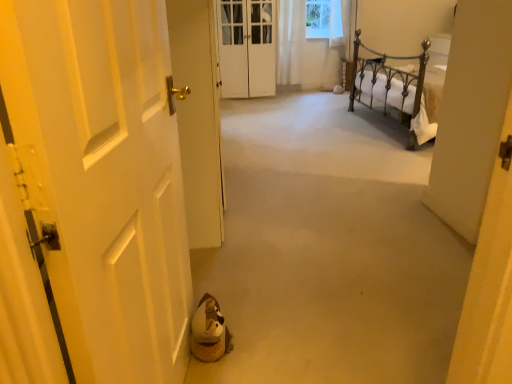
Where is `white matte door at left, which appears as the 3th door when viewed from the back`? The height and width of the screenshot is (384, 512). white matte door at left, which appears as the 3th door when viewed from the back is located at coordinates (103, 178).

This screenshot has height=384, width=512. Describe the element at coordinates (103, 178) in the screenshot. I see `white matte door at left, which ranks as the first door in front-to-back order` at that location.

Where is `white sheer curtain at upper center`? The width and height of the screenshot is (512, 384). white sheer curtain at upper center is located at coordinates [291, 41].

Describe the element at coordinates (247, 48) in the screenshot. The image size is (512, 384). I see `white wooden door at center, the 3th door positioned from the front` at that location.

This screenshot has width=512, height=384. In order to click on white matte door at left, which appears as the 3th door when viewed from the back in this screenshot , I will do `click(103, 178)`.

Is white matte door at left, which appears as the 3th door when viewed from the back, at the right side of white sheer curtain at upper center?

No.

Would you say white sheer curtain at upper center is part of white matte door at left, which appears as the 3th door when viewed from the back,'s contents?

No, white sheer curtain at upper center is not surrounded by white matte door at left, which appears as the 3th door when viewed from the back.

From the image's perspective, is white matte door at left, which appears as the 3th door when viewed from the back, beneath white sheer curtain at upper center?

Indeed, from the image's perspective, white matte door at left, which appears as the 3th door when viewed from the back, is shown beneath white sheer curtain at upper center.

Which door is the 2nd one when counting from the left side of the beige carpet at center? Please provide its 2D coordinates.

[(103, 178)]

From the picture: Can you confirm if beige carpet at center is taller than white matte door at left, which ranks as the first door in front-to-back order?

No.

Does beige carpet at center turn towards white matte door at left, which appears as the 3th door when viewed from the back?

No, beige carpet at center is not aimed at white matte door at left, which appears as the 3th door when viewed from the back.

Based on the photo, which point is more forward, (402, 262) or (139, 2)?

The point (139, 2) is closer to the camera.

Is beige carpet at center aimed at white glossy door at left, positioned as the second door in back-to-front order?

No, beige carpet at center is not facing towards white glossy door at left, positioned as the second door in back-to-front order.

Is beige carpet at center taller or shorter than white glossy door at left, the second door in the front-to-back sequence?

Considering their sizes, beige carpet at center has less height than white glossy door at left, the second door in the front-to-back sequence.

Are beige carpet at center and white glossy door at left, the second door in the front-to-back sequence, making contact?

There is a gap between beige carpet at center and white glossy door at left, the second door in the front-to-back sequence.

Is beige carpet at center thinner than white glossy door at left, positioned as the second door in back-to-front order?

In fact, beige carpet at center might be wider than white glossy door at left, positioned as the second door in back-to-front order.

Who is taller, white wooden door at center, the 3th door positioned from the front, or beige carpet at center?

Standing taller between the two is white wooden door at center, the 3th door positioned from the front.

From a real-world perspective, who is located higher, white wooden door at center, the 3th door positioned from the front, or beige carpet at center?

white wooden door at center, the 3th door positioned from the front, from a real-world perspective.

Is point (246, 43) behind point (377, 166)?

Yes.

Could you tell me if white wooden door at center, the 3th door positioned from the front, is facing beige carpet at center?

Yes, white wooden door at center, the 3th door positioned from the front, is turned towards beige carpet at center.

Is white glossy door at left, positioned as the second door in back-to-front order, spatially inside white wooden door at center, acting as the first door starting from the back, or outside of it?

The correct answer is: outside.

From the image's perspective, which one is positioned higher, white glossy door at left, positioned as the second door in back-to-front order, or white wooden door at center, acting as the first door starting from the back?

white wooden door at center, acting as the first door starting from the back, from the image's perspective.

From a real-world perspective, starting from the white wooden door at center, the 3th door positioned from the front, which door is the 1st one below it? Please provide its 2D coordinates.

[(198, 117)]

Is white glossy door at left, positioned as the second door in back-to-front order, facing away from white wooden door at center, acting as the first door starting from the back?

No, white glossy door at left, positioned as the second door in back-to-front order,'s orientation is not away from white wooden door at center, acting as the first door starting from the back.

From a real-world perspective, which object stands above the other?

From a 3D spatial view, white glossy door at left, positioned as the second door in back-to-front order, is above.

Can you tell me how much white glossy door at left, positioned as the second door in back-to-front order, and beige carpet at center differ in facing direction?

The angular difference between white glossy door at left, positioned as the second door in back-to-front order, and beige carpet at center is 90.1 degrees.

Is beige carpet at center at the back of white glossy door at left, positioned as the second door in back-to-front order?

No, white glossy door at left, positioned as the second door in back-to-front order,'s orientation is not away from beige carpet at center.

Is white sheer curtain at upper center further to the viewer compared to white glossy door at left, positioned as the second door in back-to-front order?

Yes, the depth of white sheer curtain at upper center is greater than that of white glossy door at left, positioned as the second door in back-to-front order.

From a real-world perspective, is white sheer curtain at upper center below white glossy door at left, positioned as the second door in back-to-front order?

Actually, white sheer curtain at upper center is physically above white glossy door at left, positioned as the second door in back-to-front order, in the real world.

Considering the relative sizes of white sheer curtain at upper center and white glossy door at left, the second door in the front-to-back sequence, in the image provided, is white sheer curtain at upper center taller than white glossy door at left, the second door in the front-to-back sequence,?

No.

Could you tell me if white sheer curtain at upper center is turned towards white glossy door at left, the second door in the front-to-back sequence?

No.

Where is `door that is the 3rd object located in front of the white sheer curtain at upper center`? Image resolution: width=512 pixels, height=384 pixels. door that is the 3rd object located in front of the white sheer curtain at upper center is located at coordinates (103, 178).

This screenshot has height=384, width=512. In order to click on door below the beige carpet at center (from the image's perspective) in this screenshot , I will do `click(103, 178)`.

Considering their positions, is beige carpet at center positioned further to white wooden door at center, the 3th door positioned from the front, than white sheer curtain at upper center?

The object further to white wooden door at center, the 3th door positioned from the front, is beige carpet at center.

Based on their spatial positions, is beige carpet at center or white sheer curtain at upper center closer to white glossy door at left, positioned as the second door in back-to-front order?

beige carpet at center.

Based on their spatial positions, is beige carpet at center or white sheer curtain at upper center closer to white matte door at left, which ranks as the first door in front-to-back order?

beige carpet at center.

Considering their positions, is beige carpet at center positioned further to white wooden door at center, acting as the first door starting from the back, than white glossy door at left, positioned as the second door in back-to-front order?

white glossy door at left, positioned as the second door in back-to-front order, lies further to white wooden door at center, acting as the first door starting from the back, than the other object.

Based on their spatial positions, is beige carpet at center or white glossy door at left, positioned as the second door in back-to-front order, further from white sheer curtain at upper center?

Among the two, white glossy door at left, positioned as the second door in back-to-front order, is located further to white sheer curtain at upper center.

From the image, which object appears to be nearer to white sheer curtain at upper center, white wooden door at center, the 3th door positioned from the front, or beige carpet at center?

white wooden door at center, the 3th door positioned from the front.

From the picture: Which object lies further to the anchor point white matte door at left, which ranks as the first door in front-to-back order, white wooden door at center, acting as the first door starting from the back, or white sheer curtain at upper center?

white sheer curtain at upper center is positioned further to the anchor white matte door at left, which ranks as the first door in front-to-back order.

Based on their spatial positions, is beige carpet at center or white wooden door at center, the 3th door positioned from the front, further from white sheer curtain at upper center?

Among the two, beige carpet at center is located further to white sheer curtain at upper center.

Where is `door located between white matte door at left, which ranks as the first door in front-to-back order, and white wooden door at center, the 3th door positioned from the front, in the depth direction`? The height and width of the screenshot is (384, 512). door located between white matte door at left, which ranks as the first door in front-to-back order, and white wooden door at center, the 3th door positioned from the front, in the depth direction is located at coordinates (198, 117).

At what (x,y) coordinates should I click in order to perform the action: click on corridor located between white matte door at left, which appears as the 3th door when viewed from the back, and white glossy door at left, positioned as the second door in back-to-front order, in the depth direction. Please return your answer as a coordinate pair (x, y). The width and height of the screenshot is (512, 384). Looking at the image, I should click on (329, 250).

You are a GUI agent. You are given a task and a screenshot of the screen. Output one action in this format:
    pyautogui.click(x=<x>, y=<y>)
    Task: Click on the corridor located between white matte door at left, which ranks as the first door in front-to-back order, and white wooden door at center, the 3th door positioned from the front, in the depth direction
    
    Given the screenshot: What is the action you would take?
    pyautogui.click(x=329, y=250)

This screenshot has width=512, height=384. Find the location of `door between white glossy door at left, positioned as the second door in back-to-front order, and white sheer curtain at upper center in the front-back direction`. door between white glossy door at left, positioned as the second door in back-to-front order, and white sheer curtain at upper center in the front-back direction is located at coordinates (247, 48).